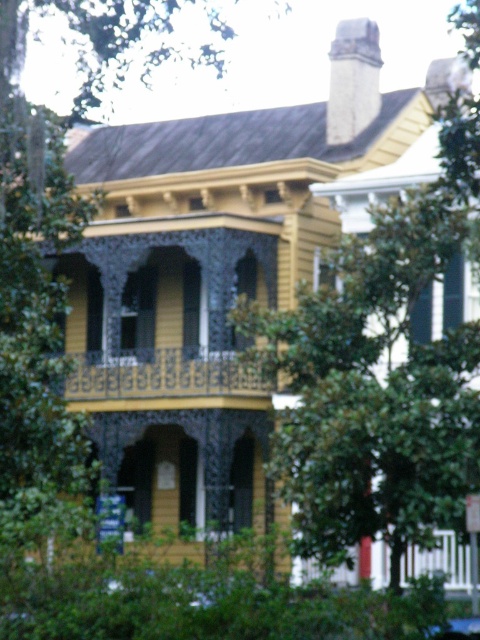
Question: Which object is farther from the camera taking this photo?

Choices:
 (A) green leafy tree at center
 (B) white stone chimney at upper center
 (C) green leafy tree at left
 (D) wooden carved railings at center

Answer: (D)

Question: Is green leafy tree at center smaller than green leafy tree at left?

Choices:
 (A) no
 (B) yes

Answer: (B)

Question: Which of the following is the closest to the observer?

Choices:
 (A) green leafy tree at center
 (B) green leafy tree at left

Answer: (B)

Question: Can you confirm if green leafy tree at left is positioned below white stone chimney at upper center?

Choices:
 (A) no
 (B) yes

Answer: (B)

Question: Is wooden carved railings at center below white stone chimney at upper center?

Choices:
 (A) no
 (B) yes

Answer: (B)

Question: Which is farther from the green leafy tree at left?

Choices:
 (A) wooden carved railings at center
 (B) green leafy tree at center

Answer: (A)